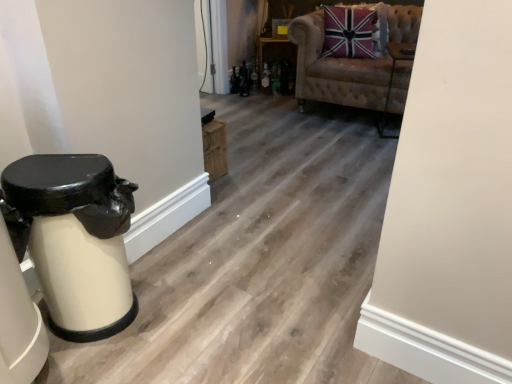
Describe the element at coordinates (74, 239) in the screenshot. I see `white glossy trash can at left` at that location.

Measure the distance between white glossy trash can at left and camera.

They are 1.35 meters apart.

I want to click on wooden shelf at center, so click(x=276, y=65).

Locate an element on the screen. The height and width of the screenshot is (384, 512). white glossy trash can at left is located at coordinates (74, 239).

Is wooden shelf at center completely or partially inside velvet beige armchair at upper center?

No, velvet beige armchair at upper center does not contain wooden shelf at center.

Which is more to the left, velvet beige armchair at upper center or wooden shelf at center?

From the viewer's perspective, wooden shelf at center appears more on the left side.

From the image's perspective, which is below, velvet beige armchair at upper center or wooden shelf at center?

velvet beige armchair at upper center appears lower in the image.

Between point (419, 18) and point (289, 41), which one is positioned in front?

The point (419, 18) is in front.

Would you say velvet union jack pillow at upper right is outside velvet beige armchair at upper center?

Actually, velvet union jack pillow at upper right is within velvet beige armchair at upper center.

Between velvet union jack pillow at upper right and velvet beige armchair at upper center, which one has smaller width?

velvet union jack pillow at upper right.

Considering the points (330, 22) and (400, 110), which point is in front, point (330, 22) or point (400, 110)?

The point (400, 110) is more forward.

How far apart are velvet union jack pillow at upper right and velvet beige armchair at upper center?

velvet union jack pillow at upper right and velvet beige armchair at upper center are 22.51 centimeters apart from each other.

Who is taller, velvet union jack pillow at upper right or white glossy trash can at left?

white glossy trash can at left.

How far apart are velvet union jack pillow at upper right and white glossy trash can at left?

velvet union jack pillow at upper right is 2.81 meters away from white glossy trash can at left.

Is velvet union jack pillow at upper right bigger or smaller than white glossy trash can at left?

In the image, velvet union jack pillow at upper right appears to be smaller than white glossy trash can at left.

From the picture: Is velvet union jack pillow at upper right surrounding white glossy trash can at left?

That's incorrect, white glossy trash can at left is not inside velvet union jack pillow at upper right.

Does velvet beige armchair at upper center have a lesser width compared to velvet union jack pillow at upper right?

No, velvet beige armchair at upper center is not thinner than velvet union jack pillow at upper right.

Is velvet beige armchair at upper center facing away from velvet union jack pillow at upper right?

Correct, velvet beige armchair at upper center is looking away from velvet union jack pillow at upper right.

Does velvet beige armchair at upper center have a larger size compared to velvet union jack pillow at upper right?

Yes, velvet beige armchair at upper center is bigger than velvet union jack pillow at upper right.

Is velvet beige armchair at upper center spatially inside velvet union jack pillow at upper right, or outside of it?

velvet beige armchair at upper center exists outside the volume of velvet union jack pillow at upper right.

Is white glossy trash can at left aimed at velvet beige armchair at upper center?

No, white glossy trash can at left is not oriented towards velvet beige armchair at upper center.

Is white glossy trash can at left positioned before velvet beige armchair at upper center?

Yes, white glossy trash can at left is closer to the camera.

Are white glossy trash can at left and velvet beige armchair at upper center making contact?

No.

Is white glossy trash can at left facing towards wooden shelf at center?

No, white glossy trash can at left does not turn towards wooden shelf at center.

Is white glossy trash can at left wider or thinner than wooden shelf at center?

Clearly, white glossy trash can at left has less width compared to wooden shelf at center.

Does point (123, 258) lie in front of point (289, 74)?

Yes, point (123, 258) is in front of point (289, 74).

Who is shorter, white glossy trash can at left or wooden shelf at center?

Standing shorter between the two is wooden shelf at center.

What's the angular difference between white glossy trash can at left and velvet union jack pillow at upper right's facing directions?

The facing directions of white glossy trash can at left and velvet union jack pillow at upper right are 55.2 degrees apart.

Is point (128, 208) closer to viewer compared to point (337, 9)?

Yes, it is.

Is white glossy trash can at left facing away from velvet union jack pillow at upper right?

No, white glossy trash can at left is not facing the opposite direction of velvet union jack pillow at upper right.

Where is `furniture behind the velvet beige armchair at upper center`? Image resolution: width=512 pixels, height=384 pixels. furniture behind the velvet beige armchair at upper center is located at coordinates (276, 65).

This screenshot has width=512, height=384. Find the location of `chair in front of the velvet union jack pillow at upper right`. chair in front of the velvet union jack pillow at upper right is located at coordinates (335, 70).

Based on their spatial positions, is velvet union jack pillow at upper right or velvet beige armchair at upper center further from wooden shelf at center?

velvet union jack pillow at upper right.

From the picture: Which object lies further to the anchor point velvet beige armchair at upper center, wooden shelf at center or velvet union jack pillow at upper right?

The object further to velvet beige armchair at upper center is wooden shelf at center.

Consider the image. Considering their positions, is wooden shelf at center positioned closer to velvet beige armchair at upper center than white glossy trash can at left?

wooden shelf at center lies closer to velvet beige armchair at upper center than the other object.

Looking at the image, which one is located closer to velvet union jack pillow at upper right, white glossy trash can at left or velvet beige armchair at upper center?

Based on the image, velvet beige armchair at upper center appears to be nearer to velvet union jack pillow at upper right.

Based on the photo, when comparing their distances from wooden shelf at center, does velvet union jack pillow at upper right or white glossy trash can at left seem further?

white glossy trash can at left lies further to wooden shelf at center than the other object.

Looking at the image, which one is located closer to white glossy trash can at left, velvet union jack pillow at upper right or wooden shelf at center?

velvet union jack pillow at upper right is closer to white glossy trash can at left.

When comparing their distances from white glossy trash can at left, does wooden shelf at center or velvet beige armchair at upper center seem closer?

The object closer to white glossy trash can at left is velvet beige armchair at upper center.

Looking at the image, which one is located further to velvet beige armchair at upper center, velvet union jack pillow at upper right or wooden shelf at center?

The object further to velvet beige armchair at upper center is wooden shelf at center.

You are a GUI agent. You are given a task and a screenshot of the screen. Output one action in this format:
    pyautogui.click(x=<x>, y=<y>)
    Task: Click on the pillow between velvet beige armchair at upper center and wooden shelf at center along the z-axis
    This screenshot has width=512, height=384.
    Given the screenshot: What is the action you would take?
    pyautogui.click(x=349, y=33)

Image resolution: width=512 pixels, height=384 pixels. Identify the location of pillow between white glossy trash can at left and wooden shelf at center in the front-back direction. (349, 33).

At what (x,y) coordinates should I click in order to perform the action: click on chair between white glossy trash can at left and velvet union jack pillow at upper right along the z-axis. Please return your answer as a coordinate pair (x, y). Looking at the image, I should click on (335, 70).

This screenshot has width=512, height=384. I want to click on chair between white glossy trash can at left and wooden shelf at center from front to back, so click(x=335, y=70).